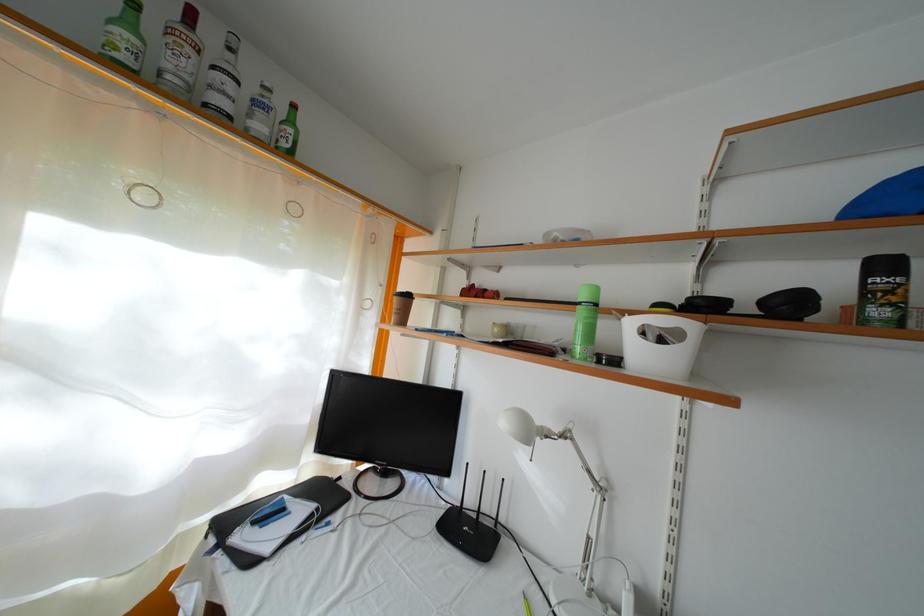
Where is `spiral notebook`? The width and height of the screenshot is (924, 616). spiral notebook is located at coordinates (277, 516).